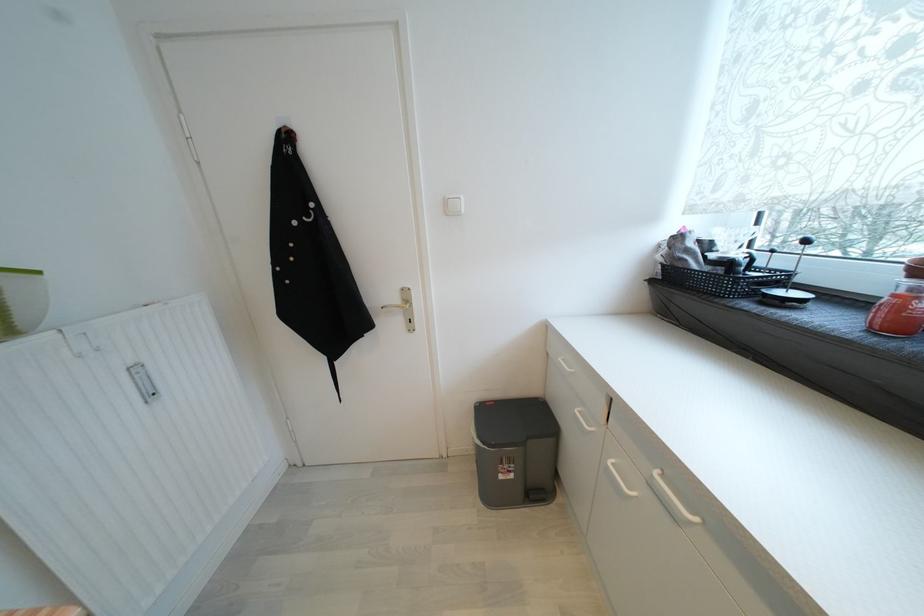
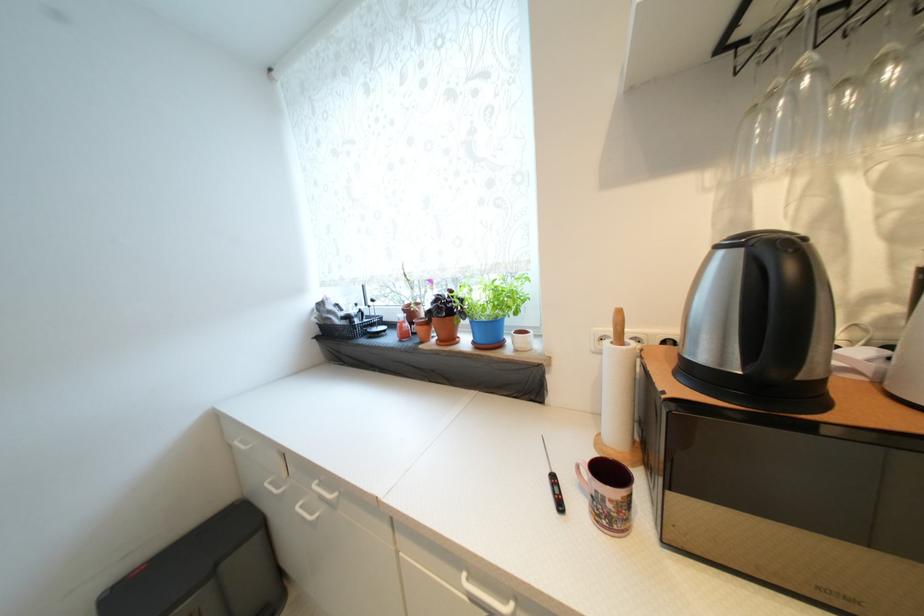
Where in the second image is the point corresponding to point 581,413 from the first image?

(271, 485)